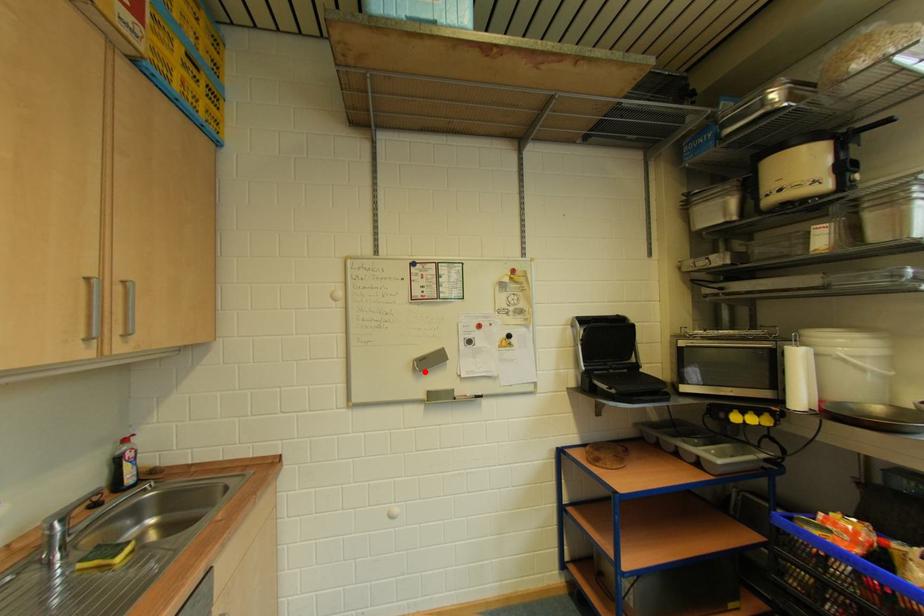
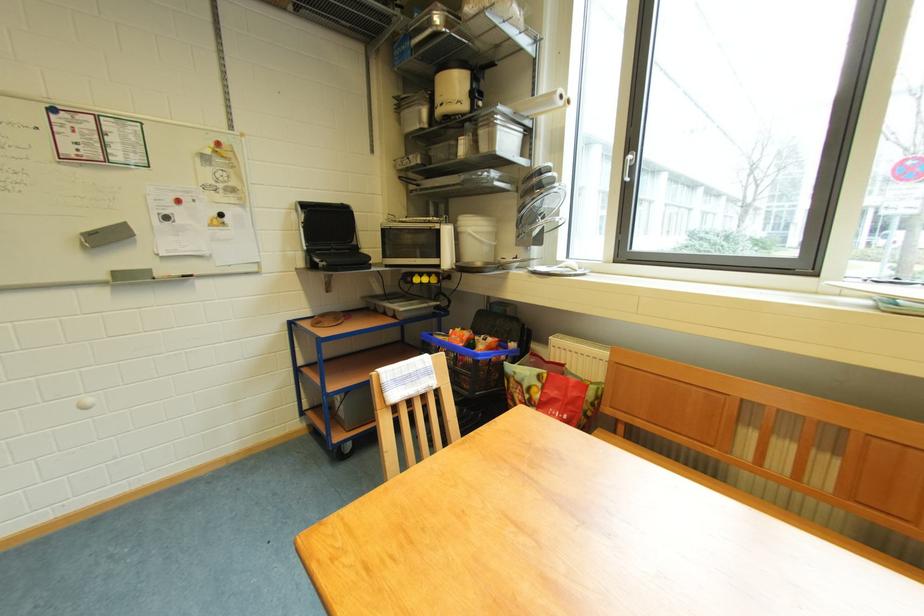
The point at the highlighted location is marked in the first image. Where is the corresponding point in the second image?

(95, 248)